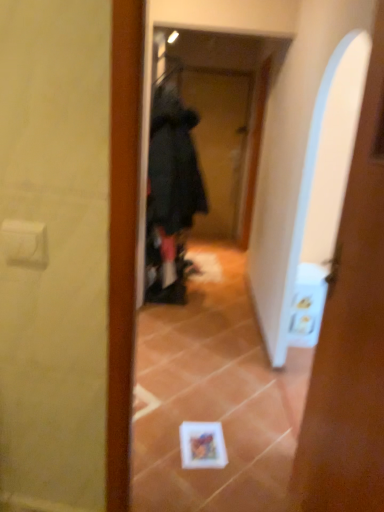
Question: Does white glossy door at center come in front of black fabric screen door at center?

Choices:
 (A) yes
 (B) no

Answer: (A)

Question: Can you confirm if white glossy door at center is bigger than black fabric screen door at center?

Choices:
 (A) no
 (B) yes

Answer: (A)

Question: Does white glossy door at center have a greater height compared to black fabric screen door at center?

Choices:
 (A) yes
 (B) no

Answer: (B)

Question: Would you say white glossy door at center is a long distance from black fabric screen door at center?

Choices:
 (A) no
 (B) yes

Answer: (B)

Question: From a real-world perspective, is white glossy door at center under black fabric screen door at center?

Choices:
 (A) no
 (B) yes

Answer: (B)

Question: Relative to black fabric screen door at center, is white glossy door at center in front or behind?

Choices:
 (A) front
 (B) behind

Answer: (A)

Question: Is white glossy door at center spatially inside black fabric screen door at center, or outside of it?

Choices:
 (A) inside
 (B) outside

Answer: (B)

Question: From their relative heights in the image, would you say white glossy door at center is taller or shorter than black fabric screen door at center?

Choices:
 (A) short
 (B) tall

Answer: (A)

Question: From a real-world perspective, relative to black fabric screen door at center, is white glossy door at center vertically above or below?

Choices:
 (A) below
 (B) above

Answer: (A)

Question: Based on their positions, is black fuzzy bathrobe at center located to the left or right of black fabric screen door at center?

Choices:
 (A) left
 (B) right

Answer: (A)

Question: Is point (148, 205) closer or farther from the camera than point (220, 232)?

Choices:
 (A) closer
 (B) farther

Answer: (A)

Question: From the image's perspective, relative to black fabric screen door at center, is black fuzzy bathrobe at center above or below?

Choices:
 (A) below
 (B) above

Answer: (A)

Question: Is black fuzzy bathrobe at center taller or shorter than black fabric screen door at center?

Choices:
 (A) tall
 (B) short

Answer: (B)

Question: Considering their positions, is black fabric screen door at center located in front of or behind white glossy door at center?

Choices:
 (A) behind
 (B) front

Answer: (A)

Question: From a real-world perspective, is black fabric screen door at center physically located above or below white glossy door at center?

Choices:
 (A) below
 (B) above

Answer: (B)